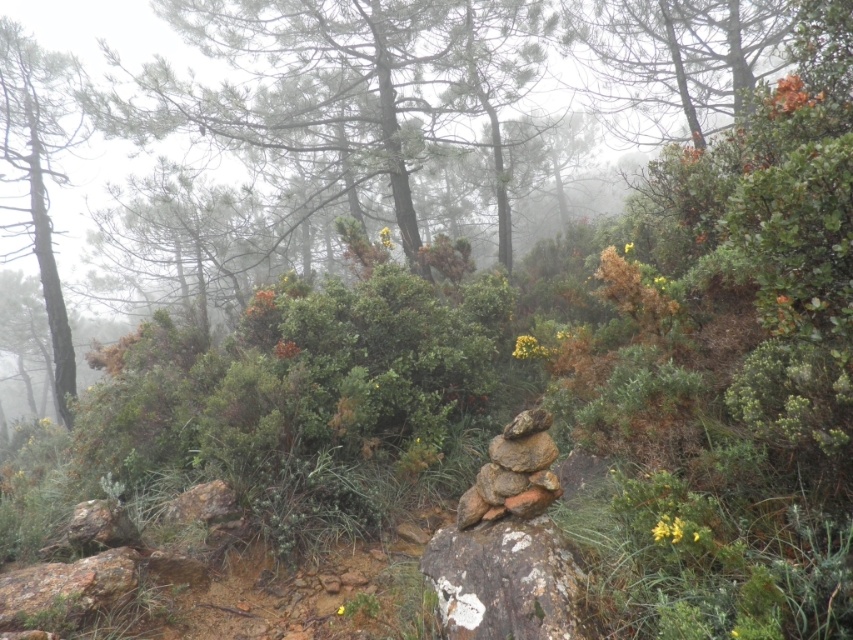
What are the coordinates of the green leafy tree at upper center in the image?

The green leafy tree at upper center is located at coordinates point (346,88).

You are a hiker trying to navigate through the misty forest. You see the green leafy tree at upper center and the white textured rock at center. Which object is closer to you?

The green leafy tree at upper center is closer to you because it is further to the viewer than the white textured rock at center, meaning it appears nearer in the scene.

You are an explorer in the misty forest and need to place a small flag on the tallest object between the white textured rock at center and the smooth brown tree trunk at left. Which object should you choose?

The smooth brown tree trunk at left is taller than the white textured rock at center, so you should place the flag on the smooth brown tree trunk at left.